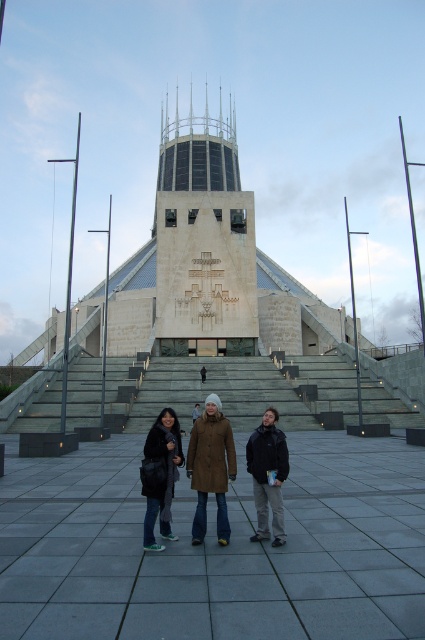
Question: Can you confirm if brown leather jacket at center is smaller than brown leather coat at center?

Choices:
 (A) yes
 (B) no

Answer: (B)

Question: From the image, what is the correct spatial relationship of gray concrete stairs at center in relation to dark brown fur coat at lower center?

Choices:
 (A) left
 (B) right

Answer: (B)

Question: Estimate the real-world distances between objects in this image. Which object is farther from the black matte jacket at lower center?

Choices:
 (A) brown leather coat at center
 (B) brown leather jacket at center
 (C) dark brown fur coat at lower center
 (D) gray concrete stairs at center

Answer: (D)

Question: Which point is closer to the camera?

Choices:
 (A) dark brown fur coat at lower center
 (B) brown leather coat at center

Answer: (A)

Question: Is gray concrete stairs at center wider than black matte jacket at lower center?

Choices:
 (A) yes
 (B) no

Answer: (A)

Question: Estimate the real-world distances between objects in this image. Which object is closer to the brown leather coat at center?

Choices:
 (A) dark brown fur coat at lower center
 (B) gray concrete stairs at center
 (C) brown leather jacket at center

Answer: (C)